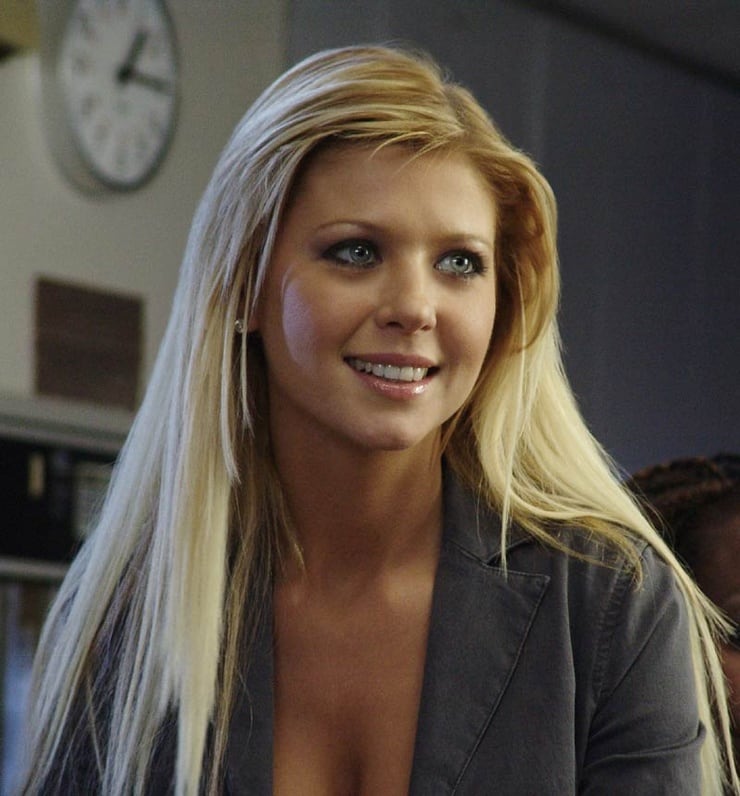
I want to click on clock, so click(x=143, y=52).